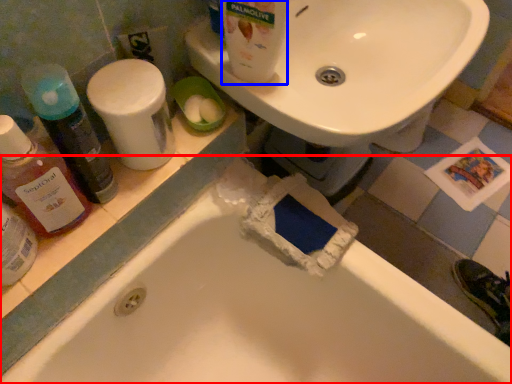
Question: Which object is further to the camera taking this photo, bathtub (highlighted by a red box) or cleaning product (highlighted by a blue box)?

Choices:
 (A) bathtub
 (B) cleaning product

Answer: (B)